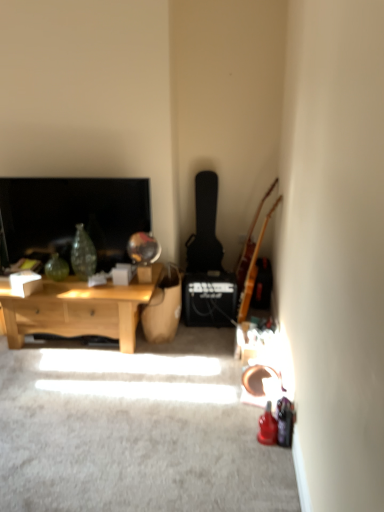
Question: Does light wood coffee table at left have a lesser width compared to matte black television at left?

Choices:
 (A) yes
 (B) no

Answer: (B)

Question: Does light wood coffee table at left appear on the right side of matte black television at left?

Choices:
 (A) yes
 (B) no

Answer: (A)

Question: Is light wood coffee table at left smaller than matte black television at left?

Choices:
 (A) no
 (B) yes

Answer: (A)

Question: From a real-world perspective, is light wood coffee table at left beneath matte black television at left?

Choices:
 (A) no
 (B) yes

Answer: (B)

Question: From a real-world perspective, is light wood coffee table at left over matte black television at left?

Choices:
 (A) no
 (B) yes

Answer: (A)

Question: Considering the relative sizes of light wood coffee table at left and matte black television at left in the image provided, is light wood coffee table at left shorter than matte black television at left?

Choices:
 (A) yes
 (B) no

Answer: (A)

Question: Considering the relative sizes of black matte guitar at center-right, the 1th guitar when ordered from left to right, and light brown wooden guitar at right, which appears as the 1th guitar when viewed from the right, in the image provided, is black matte guitar at center-right, the 1th guitar when ordered from left to right, bigger than light brown wooden guitar at right, which appears as the 1th guitar when viewed from the right,?

Choices:
 (A) no
 (B) yes

Answer: (B)

Question: Is black matte guitar at center-right, the 1th guitar when ordered from left to right, shorter than light brown wooden guitar at right, which appears as the 1th guitar when viewed from the right?

Choices:
 (A) no
 (B) yes

Answer: (B)

Question: Is black matte guitar at center-right, which is the 2th guitar in right-to-left order, turned away from light brown wooden guitar at right, which appears as the 1th guitar when viewed from the right?

Choices:
 (A) no
 (B) yes

Answer: (A)

Question: From a real-world perspective, is black matte guitar at center-right, the 1th guitar when ordered from left to right, positioned under light brown wooden guitar at right, which appears as the second guitar when viewed from the left, based on gravity?

Choices:
 (A) no
 (B) yes

Answer: (A)

Question: Is black matte guitar at center-right, the 1th guitar when ordered from left to right, positioned in front of light brown wooden guitar at right, which appears as the 1th guitar when viewed from the right?

Choices:
 (A) yes
 (B) no

Answer: (B)

Question: From the image's perspective, is black matte guitar at center-right, the 1th guitar when ordered from left to right, on light brown wooden guitar at right, which appears as the 1th guitar when viewed from the right?

Choices:
 (A) yes
 (B) no

Answer: (A)

Question: Is black matte guitar at center-right, which is the 2th guitar in right-to-left order, completely or partially outside of matte black television at left?

Choices:
 (A) no
 (B) yes

Answer: (B)